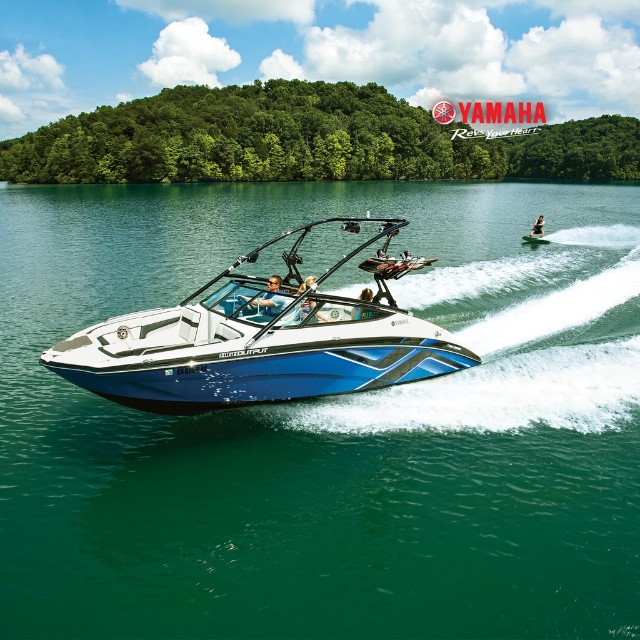
This screenshot has height=640, width=640. Describe the element at coordinates (272, 298) in the screenshot. I see `matte black sunglasses at center` at that location.

Is matte black sunglasses at center taller than blue glossy water skier at center?

Incorrect, matte black sunglasses at center's height is not larger of blue glossy water skier at center's.

Measure the distance between point (266, 300) and camera.

The distance of point (266, 300) from camera is 31.11 feet.

Identify the location of matte black sunglasses at center. Image resolution: width=640 pixels, height=640 pixels. (272, 298).

Which is in front, point (262, 300) or point (307, 314)?

Point (307, 314)

Is matte black sunglasses at center to the left of blue matte boat at center from the viewer's perspective?

Yes, matte black sunglasses at center is to the left of blue matte boat at center.

Does point (280, 285) lie behind point (305, 307)?

Yes, it is.

Locate an element on the screen. Image resolution: width=640 pixels, height=640 pixels. matte black sunglasses at center is located at coordinates pos(272,298).

Is blue glossy water at center taller than blue matte boat at center?

Yes.

This screenshot has width=640, height=640. Describe the element at coordinates (330, 428) in the screenshot. I see `blue glossy water at center` at that location.

Find the location of a particular element. This screenshot has width=640, height=640. blue glossy water at center is located at coordinates (330, 428).